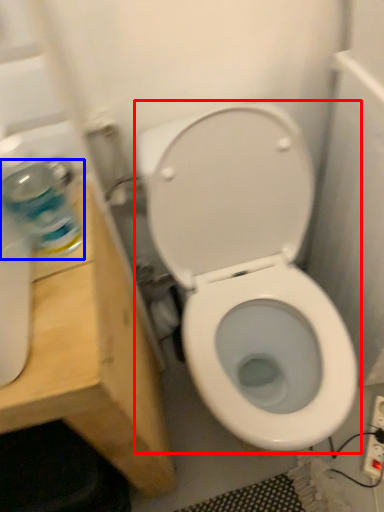
Question: Which of the following is the closest to the observer, toilet (highlighted by a red box) or cleaning product (highlighted by a blue box)?

Choices:
 (A) toilet
 (B) cleaning product

Answer: (B)